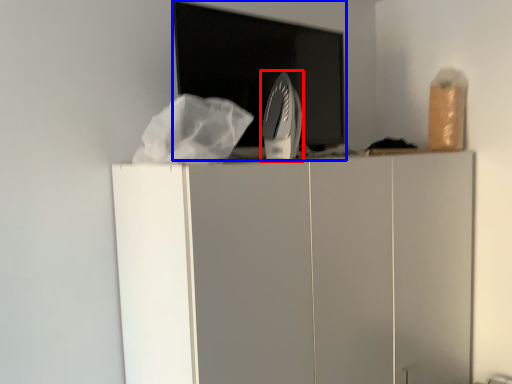
Question: Which object appears farthest to the camera in this image, home appliance (highlighted by a red box) or appliance (highlighted by a blue box)?

Choices:
 (A) home appliance
 (B) appliance

Answer: (A)